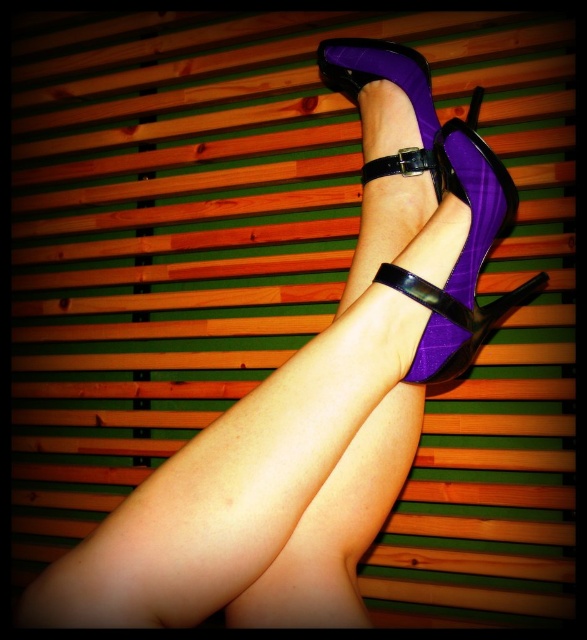
Where is `purple suede heels at center`? This screenshot has width=587, height=640. purple suede heels at center is located at coordinates (338, 524).

Which is below, purple suede heels at center or purple suede sandal at center?

purple suede heels at center is lower down.

What do you see at coordinates (338, 524) in the screenshot? I see `purple suede heels at center` at bounding box center [338, 524].

Identify the location of purple suede heels at center. This screenshot has height=640, width=587. (338, 524).